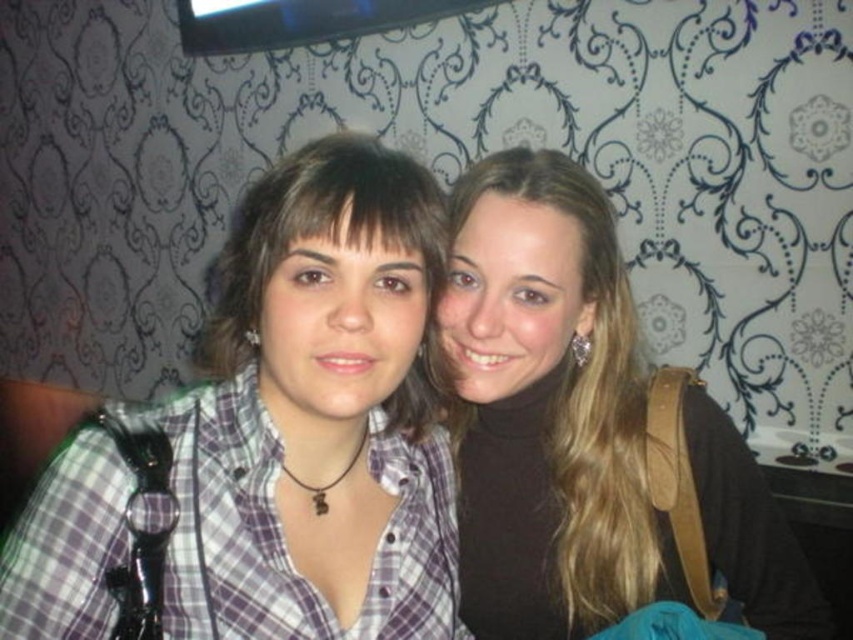
Can you confirm if plaid shirt at center is taller than smooth brown hair at center?

Incorrect, plaid shirt at center's height is not larger of smooth brown hair at center's.

Measure the distance between point (352, 512) and camera.

Point (352, 512) and camera are 30.37 inches apart from each other.

Is point (238, 346) closer to camera compared to point (608, 266)?

Yes, point (238, 346) is in front of point (608, 266).

Find the location of `plaid shirt at center`. plaid shirt at center is located at coordinates (270, 440).